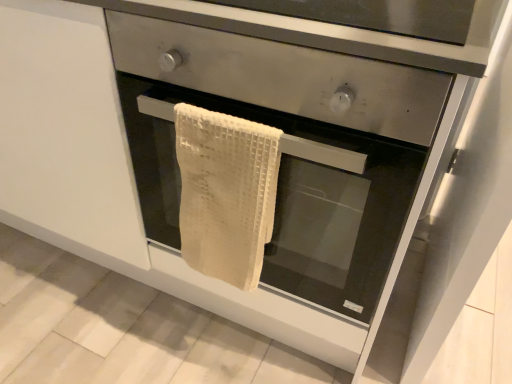
Question: From a real-world perspective, is beige woven towel at center under white waffle towel at center?

Choices:
 (A) yes
 (B) no

Answer: (A)

Question: Are beige woven towel at center and white waffle towel at center located far from each other?

Choices:
 (A) no
 (B) yes

Answer: (A)

Question: From the image's perspective, is beige woven towel at center below white waffle towel at center?

Choices:
 (A) no
 (B) yes

Answer: (B)

Question: Is beige woven towel at center positioned beyond the bounds of white waffle towel at center?

Choices:
 (A) no
 (B) yes

Answer: (B)

Question: Can white waffle towel at center be found inside beige woven towel at center?

Choices:
 (A) yes
 (B) no

Answer: (B)

Question: Considering their positions, is white waffle towel at center located in front of or behind beige woven towel at center?

Choices:
 (A) behind
 (B) front

Answer: (B)

Question: Is white waffle towel at center bigger or smaller than beige woven towel at center?

Choices:
 (A) small
 (B) big

Answer: (B)

Question: From a real-world perspective, is white waffle towel at center positioned above or below beige woven towel at center?

Choices:
 (A) above
 (B) below

Answer: (A)

Question: Is white waffle towel at center inside the boundaries of beige woven towel at center, or outside?

Choices:
 (A) inside
 (B) outside

Answer: (B)

Question: In terms of height, does beige woven towel at center look taller or shorter compared to white woven towel at center?

Choices:
 (A) short
 (B) tall

Answer: (A)

Question: From a real-world perspective, is beige woven towel at center physically located above or below white woven towel at center?

Choices:
 (A) above
 (B) below

Answer: (A)

Question: Considering the positions of point (217, 160) and point (276, 221), is point (217, 160) closer or farther from the camera than point (276, 221)?

Choices:
 (A) farther
 (B) closer

Answer: (B)

Question: Considering the positions of beige woven towel at center and white woven towel at center in the image, is beige woven towel at center wider or thinner than white woven towel at center?

Choices:
 (A) thin
 (B) wide

Answer: (A)

Question: Looking at the image, does white waffle towel at center seem bigger or smaller compared to white woven towel at center?

Choices:
 (A) small
 (B) big

Answer: (A)

Question: Does point (261, 84) appear closer or farther from the camera than point (407, 178)?

Choices:
 (A) closer
 (B) farther

Answer: (B)